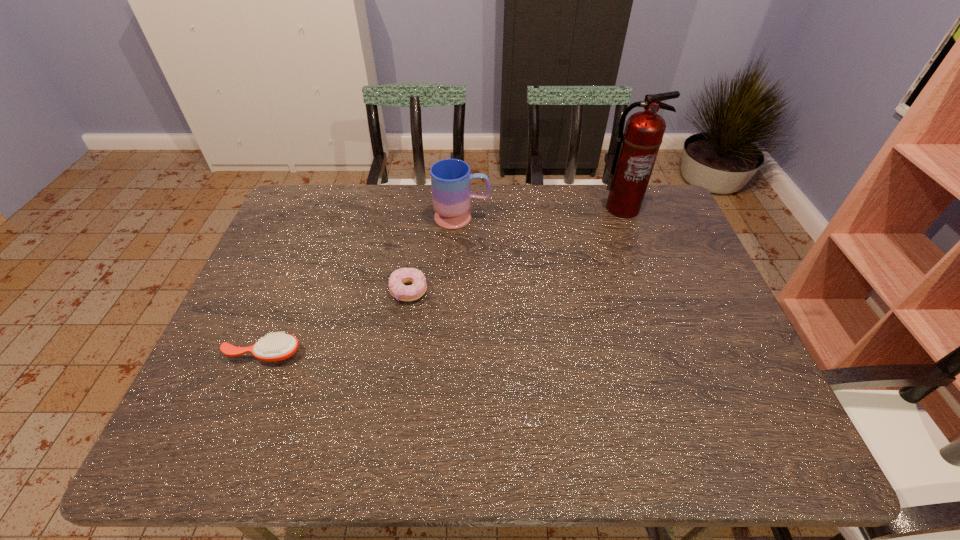
Locate an element on the screen. The height and width of the screenshot is (540, 960). the tallest object is located at coordinates (637, 148).

Where is `fire extinguisher`? Image resolution: width=960 pixels, height=540 pixels. fire extinguisher is located at coordinates click(x=637, y=148).

Locate an element on the screen. The width and height of the screenshot is (960, 540). the third shortest object is located at coordinates (451, 179).

The height and width of the screenshot is (540, 960). In order to click on the third farthest object in this screenshot , I will do `click(397, 289)`.

You are a GUI agent. You are given a task and a screenshot of the screen. Output one action in this format:
    pyautogui.click(x=<x>, y=<y>)
    Task: Click on the nearest object
    This screenshot has height=540, width=960.
    Given the screenshot: What is the action you would take?
    278,346

This screenshot has width=960, height=540. In order to click on hairbrush in this screenshot , I will do `click(278, 346)`.

You are a GUI agent. You are given a task and a screenshot of the screen. Output one action in this format:
    pyautogui.click(x=<x>, y=<y>)
    Task: Click on the free space located 0.380m on the nozzle side of the tallest object
    This screenshot has height=540, width=960.
    Given the screenshot: What is the action you would take?
    pyautogui.click(x=660, y=312)

Identify the location of vacant space located on the side of the mug with the handle. This screenshot has height=540, width=960. (509, 218).

The image size is (960, 540). Identify the location of free space located on the front of the third farthest object. (392, 404).

Locate an element on the screen. This screenshot has height=540, width=960. vacant region located on the back of the nearest object is located at coordinates (302, 256).